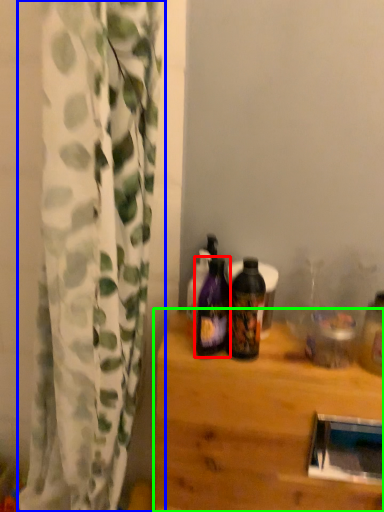
Question: Which object is positioned closest to bottle (highlighted by a red box)? Select from curtain (highlighted by a blue box) and table (highlighted by a green box).

Choices:
 (A) curtain
 (B) table

Answer: (B)